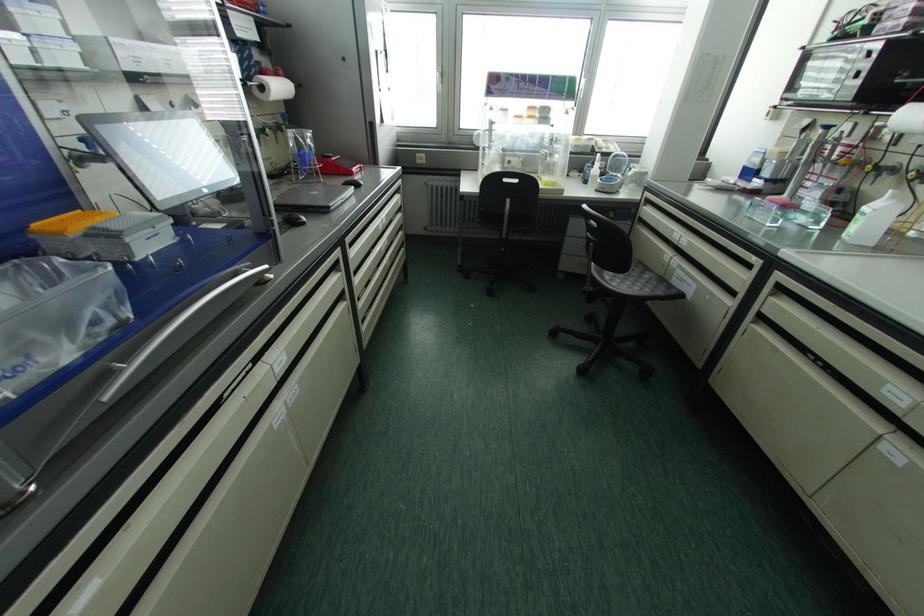
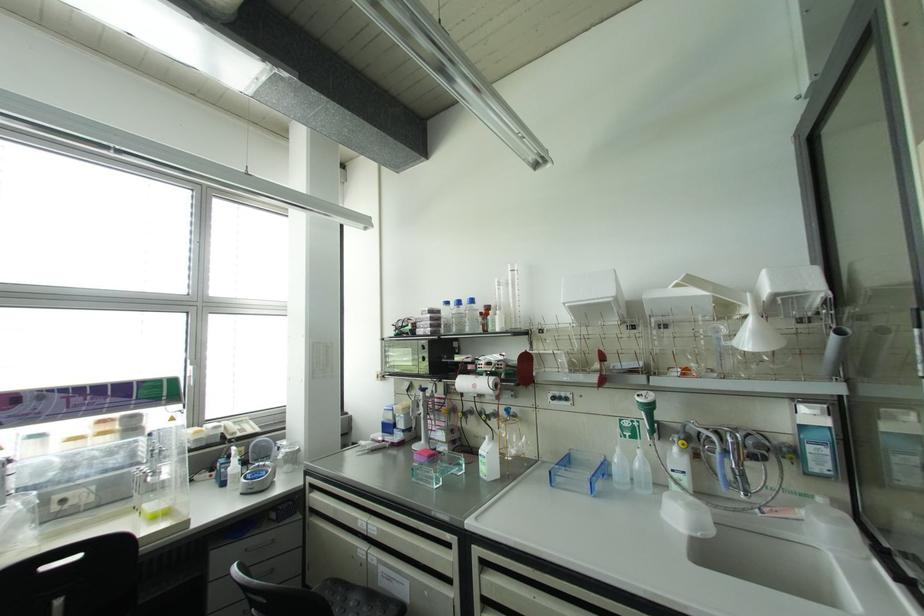
Locate, in the second image, the point that corresponds to pixel 582 81 in the first image.

(189, 368)